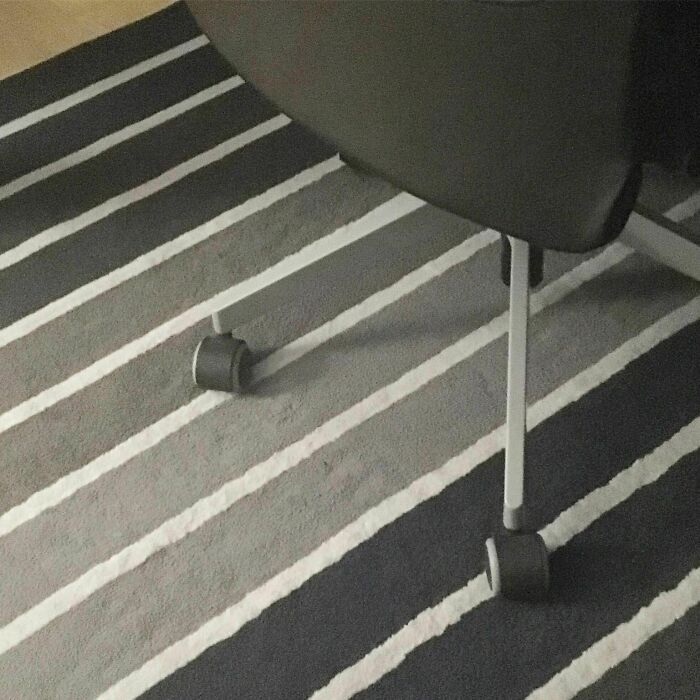
At what (x,y) coordinates should I click in order to perform the action: click on chair. Please return your answer as a coordinate pair (x, y). Image resolution: width=700 pixels, height=700 pixels. Looking at the image, I should click on (372, 57).